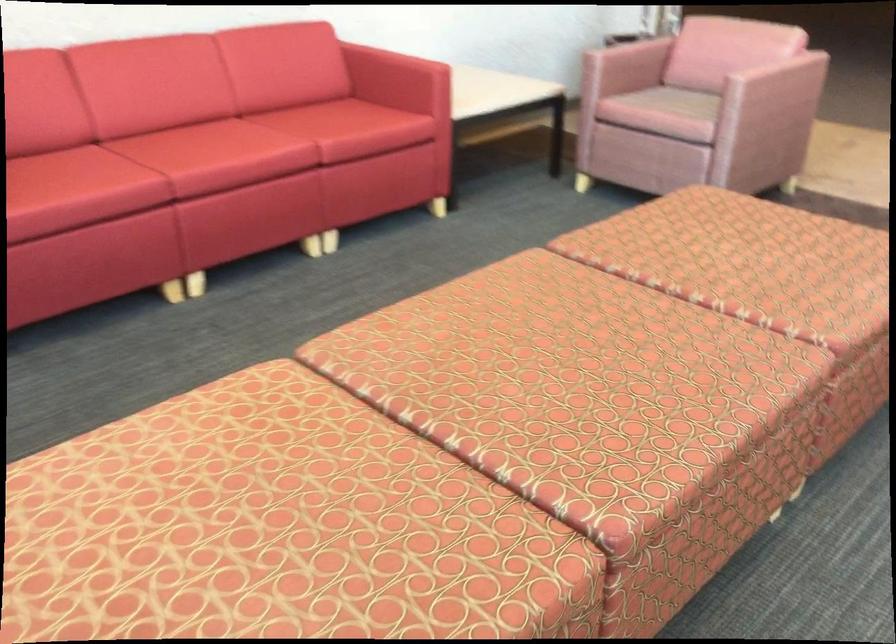
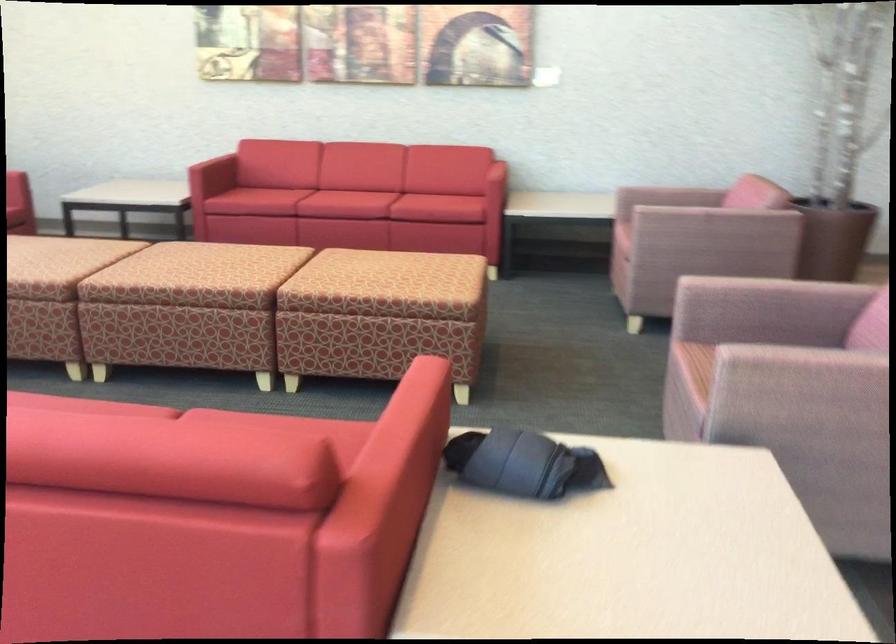
Where in the second image is the point corresponding to pixel 574 406 from the first image?

(186, 263)